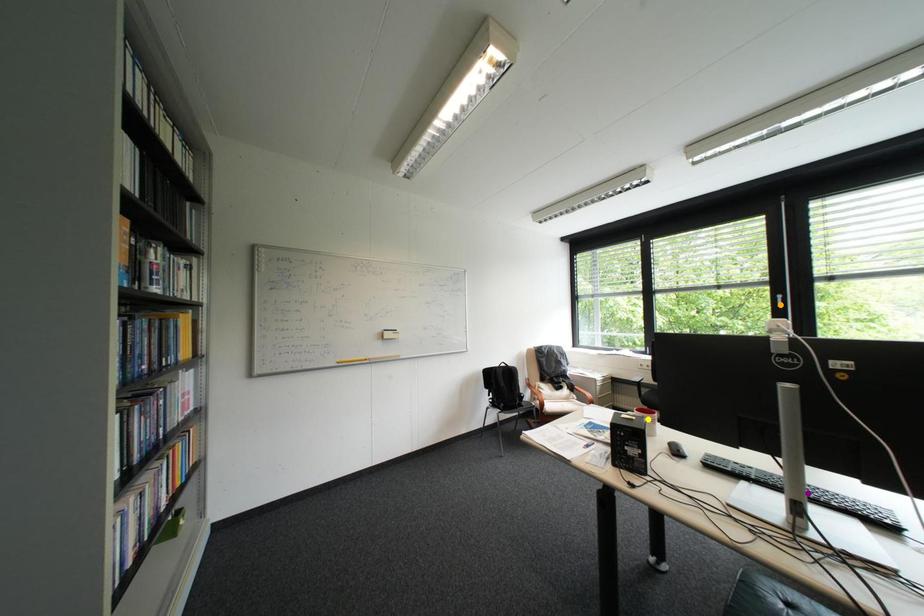
Order these from farthest to nearest:
- purple point
- yellow point
- orange point

yellow point < orange point < purple point